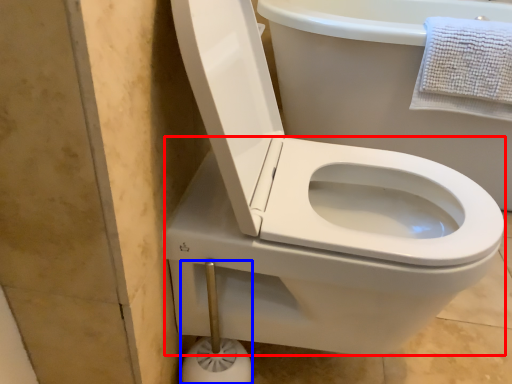
Question: Which of the following is the farthest to the observer, bidet (highlighted by a red box) or towel bar (highlighted by a blue box)?

Choices:
 (A) bidet
 (B) towel bar

Answer: (B)